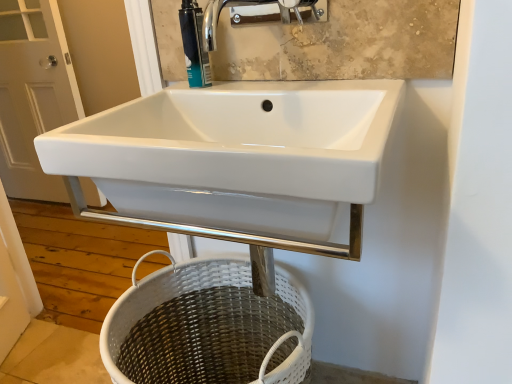
Question: Considering the relative positions of white woven basket at lower center and white glossy door at left in the image provided, is white woven basket at lower center in front of white glossy door at left?

Choices:
 (A) yes
 (B) no

Answer: (A)

Question: Could you tell me if white woven basket at lower center is facing white glossy door at left?

Choices:
 (A) no
 (B) yes

Answer: (A)

Question: Is white woven basket at lower center shorter than white glossy door at left?

Choices:
 (A) yes
 (B) no

Answer: (A)

Question: Can white glossy door at left be found inside white woven basket at lower center?

Choices:
 (A) no
 (B) yes

Answer: (A)

Question: Considering the relative sizes of white woven basket at lower center and white glossy door at left in the image provided, is white woven basket at lower center smaller than white glossy door at left?

Choices:
 (A) no
 (B) yes

Answer: (A)

Question: Does point (287, 0) appear closer or farther from the camera than point (236, 355)?

Choices:
 (A) farther
 (B) closer

Answer: (B)

Question: Relative to white woven basket at lower center, is chrome metallic faucet at upper center in front or behind?

Choices:
 (A) behind
 (B) front

Answer: (B)

Question: Do you think chrome metallic faucet at upper center is within white woven basket at lower center, or outside of it?

Choices:
 (A) inside
 (B) outside

Answer: (B)

Question: Is chrome metallic faucet at upper center bigger or smaller than white woven basket at lower center?

Choices:
 (A) big
 (B) small

Answer: (B)

Question: Is point (196, 26) closer or farther from the camera than point (29, 180)?

Choices:
 (A) closer
 (B) farther

Answer: (A)

Question: Is teal plastic soap dispenser at upper center inside the boundaries of white glossy door at left, or outside?

Choices:
 (A) inside
 (B) outside

Answer: (B)

Question: In the image, is teal plastic soap dispenser at upper center positioned in front of or behind white glossy door at left?

Choices:
 (A) behind
 (B) front

Answer: (B)

Question: Visually, is teal plastic soap dispenser at upper center positioned to the left or to the right of white glossy door at left?

Choices:
 (A) left
 (B) right

Answer: (B)

Question: Based on their sizes in the image, would you say chrome metallic faucet at upper center is bigger or smaller than white glossy sink at center?

Choices:
 (A) small
 (B) big

Answer: (A)

Question: Does point (209, 28) appear closer or farther from the camera than point (175, 153)?

Choices:
 (A) closer
 (B) farther

Answer: (B)